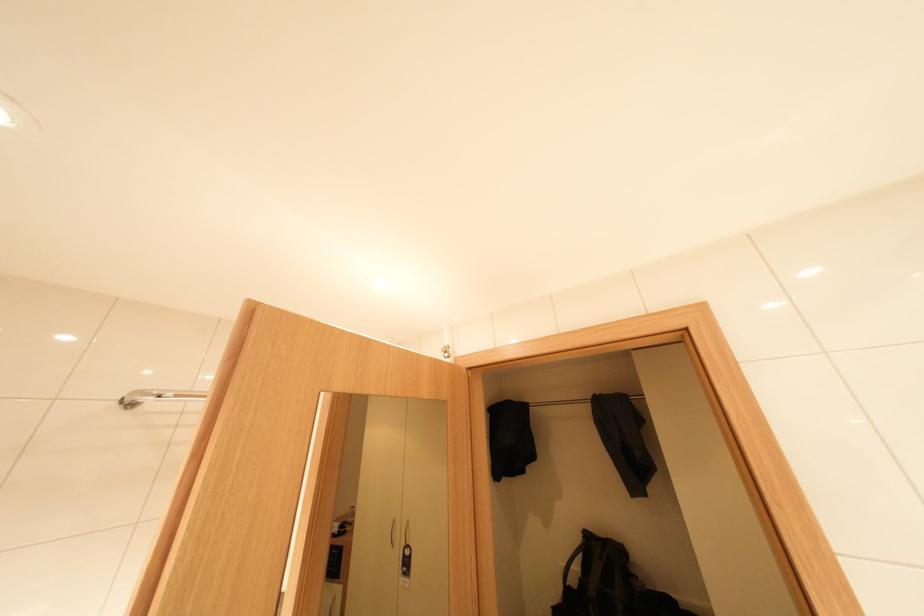
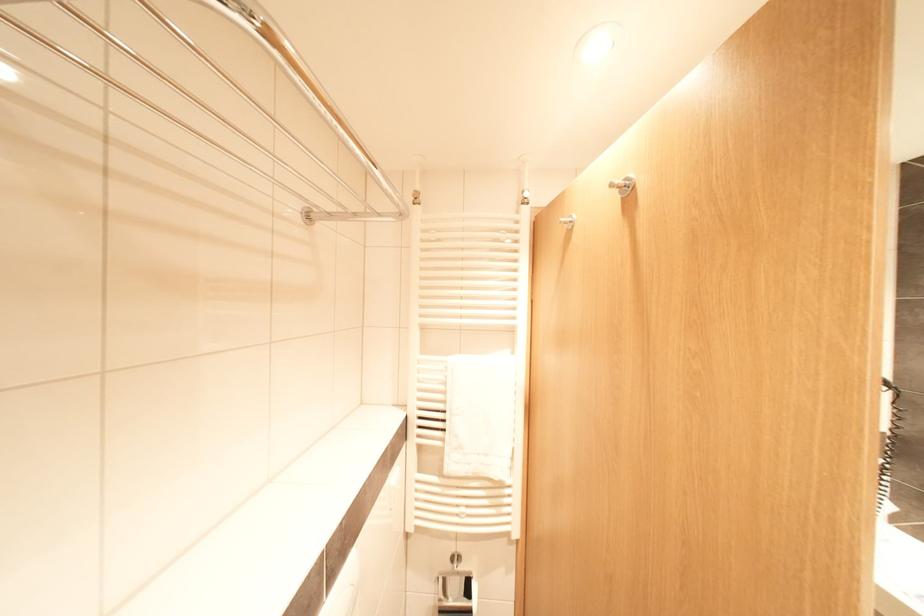
First-person continuous shooting, in which direction is the camera rotating?

The camera's rotation is toward right-down.